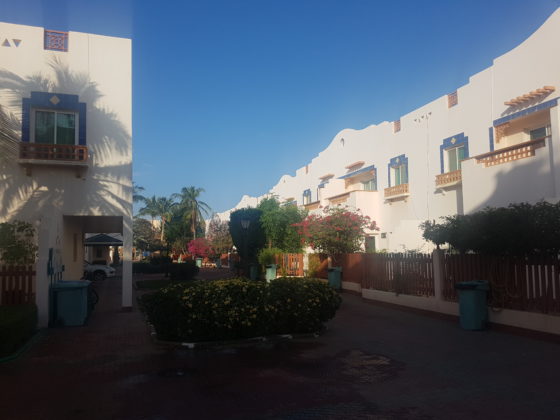
At what (x,y) coordinates should I click in order to perform the action: click on blue frames at top of windows. Please return your answer as a coordinate pair (x, y). The image size is (560, 420). Looking at the image, I should click on (394, 158), (455, 136).